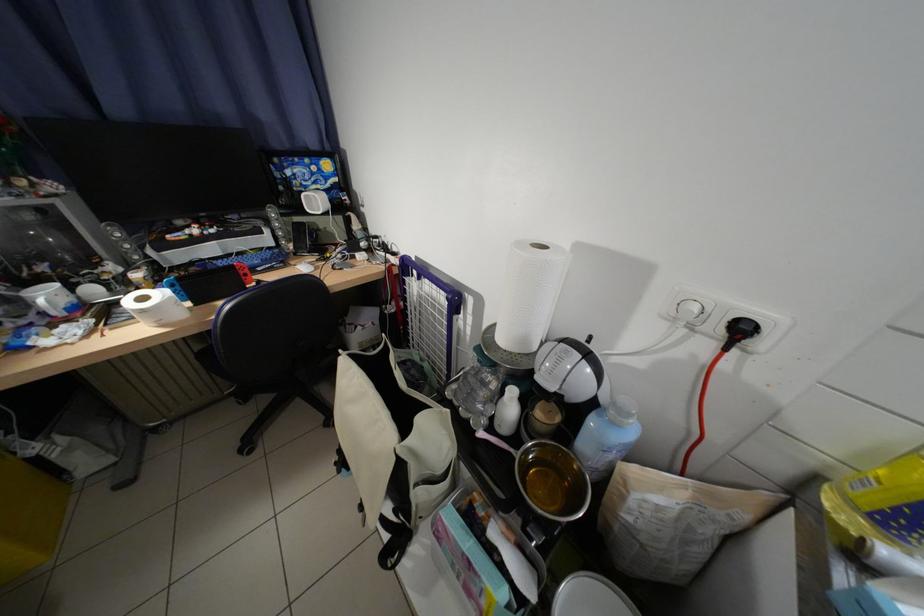
At what (x,y) coordinates should I click in order to perform the action: click on red power plug. Please return your answer as a coordinate pair (x, y). Looking at the image, I should click on (748, 326).